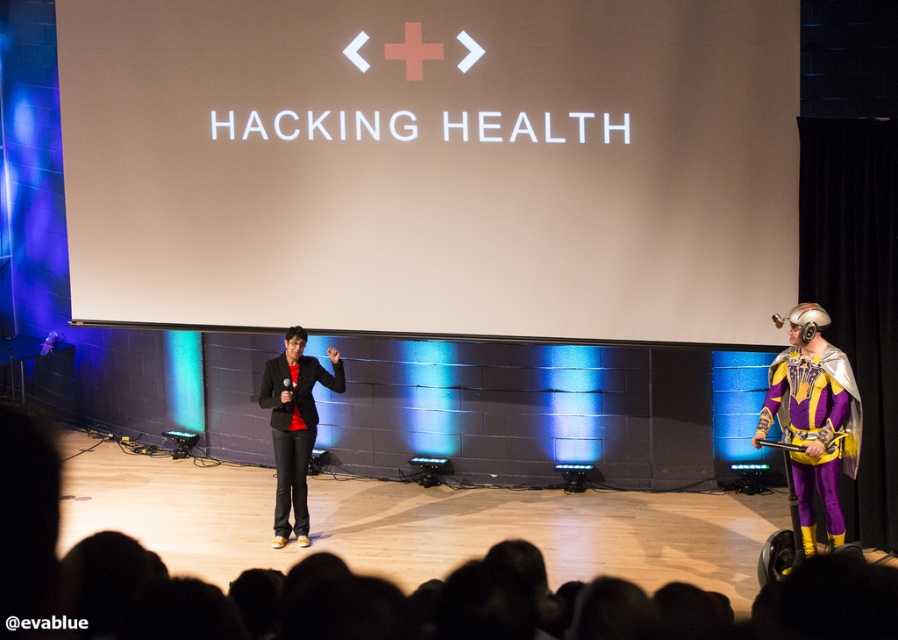
Can you confirm if purple shiny costume at right is smaller than black matte suit at center?

No, purple shiny costume at right is not smaller than black matte suit at center.

Looking at this image, does purple shiny costume at right appear on the right side of black matte suit at center?

Indeed, purple shiny costume at right is positioned on the right side of black matte suit at center.

This screenshot has width=898, height=640. Describe the element at coordinates (813, 417) in the screenshot. I see `purple shiny costume at right` at that location.

I want to click on purple shiny costume at right, so click(x=813, y=417).